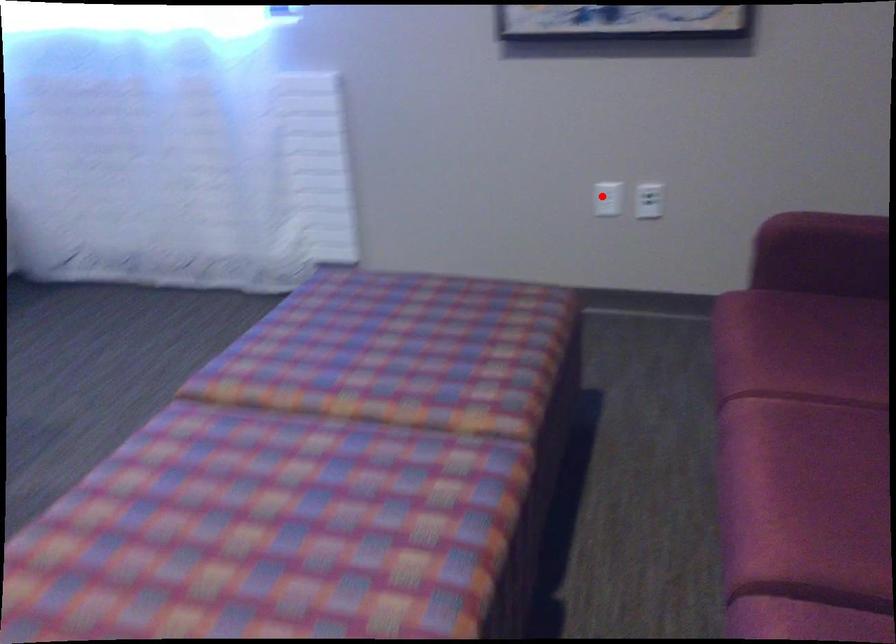
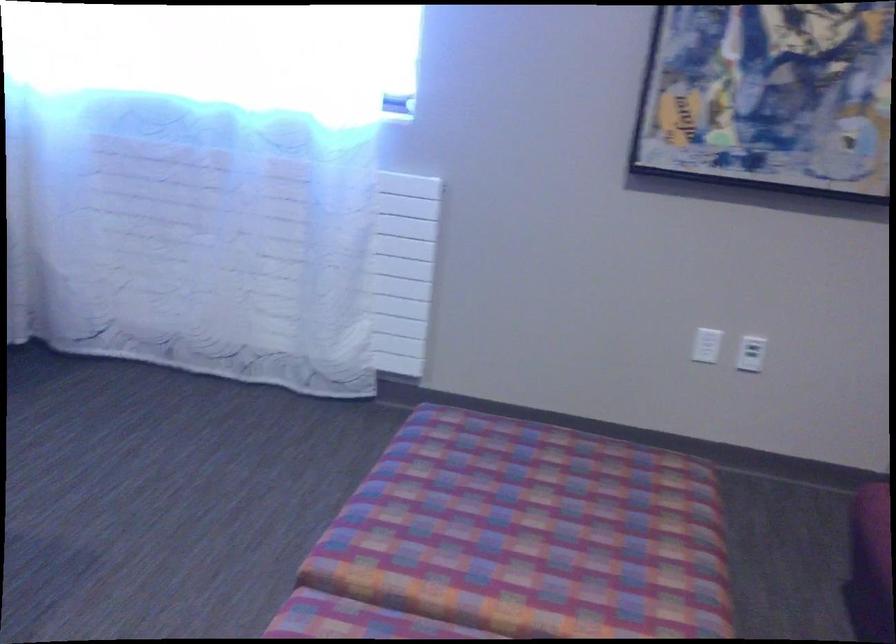
Find the pixel in the second image that matches the highlighted location in the first image.

(707, 345)